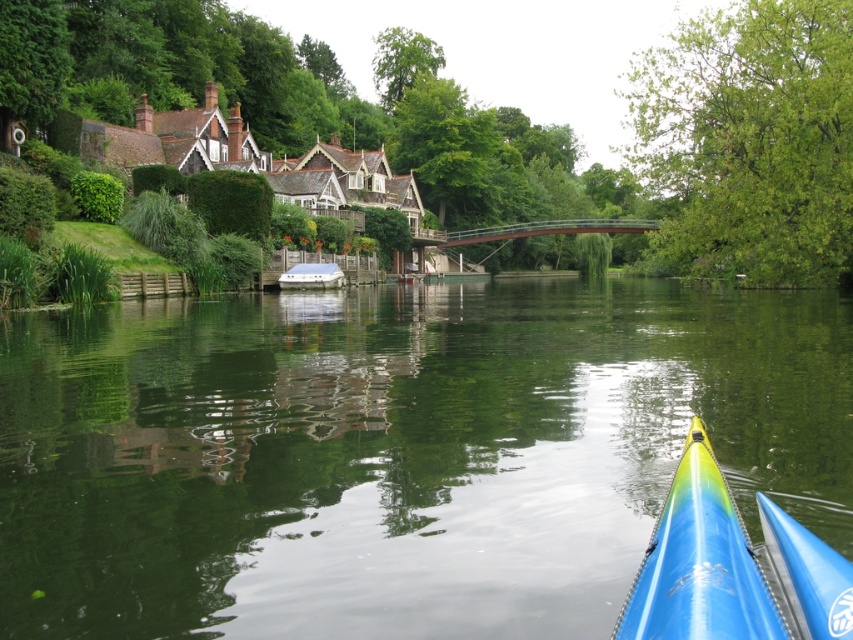
Question: Which point is farther to the camera?

Choices:
 (A) green smooth water at center
 (B) blue glossy canoe at lower right
 (C) white plastic boat at center
 (D) shiny blue kayak at lower right

Answer: (C)

Question: Is green smooth water at center thinner than white plastic boat at center?

Choices:
 (A) no
 (B) yes

Answer: (A)

Question: Is blue glossy canoe at lower right positioned at the back of white plastic boat at center?

Choices:
 (A) no
 (B) yes

Answer: (A)

Question: Which object is the closest to the green smooth water at center?

Choices:
 (A) shiny blue kayak at lower right
 (B) blue glossy canoe at lower right

Answer: (A)

Question: Considering the relative positions of shiny blue kayak at lower right and blue glossy canoe at lower right in the image provided, where is shiny blue kayak at lower right located with respect to blue glossy canoe at lower right?

Choices:
 (A) below
 (B) above

Answer: (B)

Question: Which object appears closest to the camera in this image?

Choices:
 (A) green smooth water at center
 (B) shiny blue kayak at lower right
 (C) white plastic boat at center
 (D) blue glossy canoe at lower right

Answer: (B)